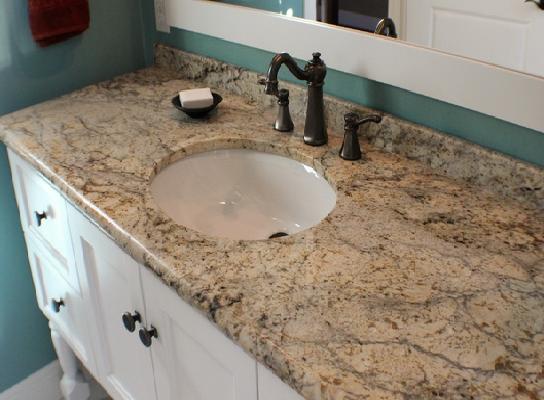
Find the location of a particular element. towel is located at coordinates (50, 16).